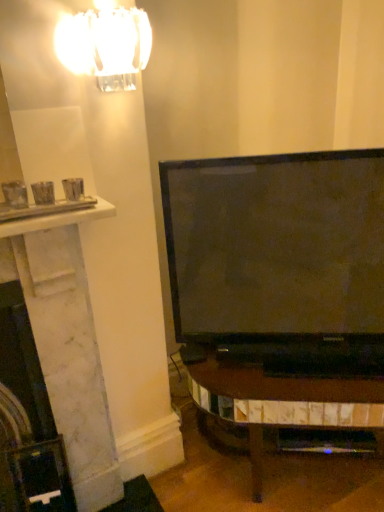
Locate an element on the screen. clear glass chandelier at upper left is located at coordinates (105, 45).

What is the approximate width of clear glass chandelier at upper left?

It is 13.60 centimeters.

Describe the element at coordinates (105, 45) in the screenshot. I see `clear glass chandelier at upper left` at that location.

Find the location of `white marble fireplace at left`. white marble fireplace at left is located at coordinates (67, 345).

What do you see at coordinates (67, 345) in the screenshot? The image size is (384, 512). I see `white marble fireplace at left` at bounding box center [67, 345].

Find the location of `clear glass chandelier at upper left`. clear glass chandelier at upper left is located at coordinates (105, 45).

Looking at this image, which object is positioned more to the left, clear glass chandelier at upper left or white marble fireplace at left?

white marble fireplace at left.

Which object is closer to the camera taking this photo, clear glass chandelier at upper left or white marble fireplace at left?

clear glass chandelier at upper left.

Which point is more forward, (141, 58) or (64, 258)?

The point (141, 58) is closer.

From the image's perspective, which one is positioned lower, clear glass chandelier at upper left or white marble fireplace at left?

white marble fireplace at left.

From a real-world perspective, between clear glass chandelier at upper left and white marble fireplace at left, who is vertically lower?

white marble fireplace at left is physically lower.

Between clear glass chandelier at upper left and white marble fireplace at left, which one has smaller width?

clear glass chandelier at upper left is thinner.

Who is taller, clear glass chandelier at upper left or white marble fireplace at left?

Standing taller between the two is white marble fireplace at left.

Considering the sizes of objects clear glass chandelier at upper left and white marble fireplace at left in the image provided, who is bigger, clear glass chandelier at upper left or white marble fireplace at left?

white marble fireplace at left.

Does clear glass chandelier at upper left contain white marble fireplace at left?

Definitely not — white marble fireplace at left is not inside clear glass chandelier at upper left.

Is there a large distance between clear glass chandelier at upper left and white marble fireplace at left?

No.

Is clear glass chandelier at upper left looking in the opposite direction of white marble fireplace at left?

clear glass chandelier at upper left does not have its back to white marble fireplace at left.

How many degrees apart are the facing directions of clear glass chandelier at upper left and white marble fireplace at left?

0.621 degrees separate the facing orientations of clear glass chandelier at upper left and white marble fireplace at left.

Where is `lamp in front of the white marble fireplace at left`? This screenshot has height=512, width=384. lamp in front of the white marble fireplace at left is located at coordinates (105, 45).

Is white marble fireplace at left to the right of clear glass chandelier at upper left from the viewer's perspective?

No.

Is the depth of white marble fireplace at left less than that of clear glass chandelier at upper left?

No, white marble fireplace at left is further to the viewer.

Considering the points (42, 342) and (101, 75), which point is in front, point (42, 342) or point (101, 75)?

Point (101, 75)

From the image's perspective, relative to clear glass chandelier at upper left, is white marble fireplace at left above or below?

Clearly, from the image's perspective, white marble fireplace at left is below clear glass chandelier at upper left.

From a real-world perspective, which object stands above the other?

In real-world perspective, clear glass chandelier at upper left is above.

Consider the image. Can you confirm if white marble fireplace at left is thinner than clear glass chandelier at upper left?

Incorrect, the width of white marble fireplace at left is not less than that of clear glass chandelier at upper left.

Who is taller, white marble fireplace at left or clear glass chandelier at upper left?

Standing taller between the two is white marble fireplace at left.

Which of these two, white marble fireplace at left or clear glass chandelier at upper left, is bigger?

Bigger between the two is white marble fireplace at left.

Is white marble fireplace at left inside or outside of clear glass chandelier at upper left?

white marble fireplace at left is not inside clear glass chandelier at upper left, it's outside.

Would you consider white marble fireplace at left to be distant from clear glass chandelier at upper left?

white marble fireplace at left is near clear glass chandelier at upper left, not far away.

Is clear glass chandelier at upper left at the back of white marble fireplace at left?

No, white marble fireplace at left's orientation is not away from clear glass chandelier at upper left.

This screenshot has height=512, width=384. I want to click on lamp on the right of the white marble fireplace at left, so click(105, 45).

At what (x,y) coordinates should I click in order to perform the action: click on lamp positioned vertically above the white marble fireplace at left (from a real-world perspective). Please return your answer as a coordinate pair (x, y). The image size is (384, 512). Looking at the image, I should click on (105, 45).

Where is `lamp in front of the white marble fireplace at left`? The image size is (384, 512). lamp in front of the white marble fireplace at left is located at coordinates (105, 45).